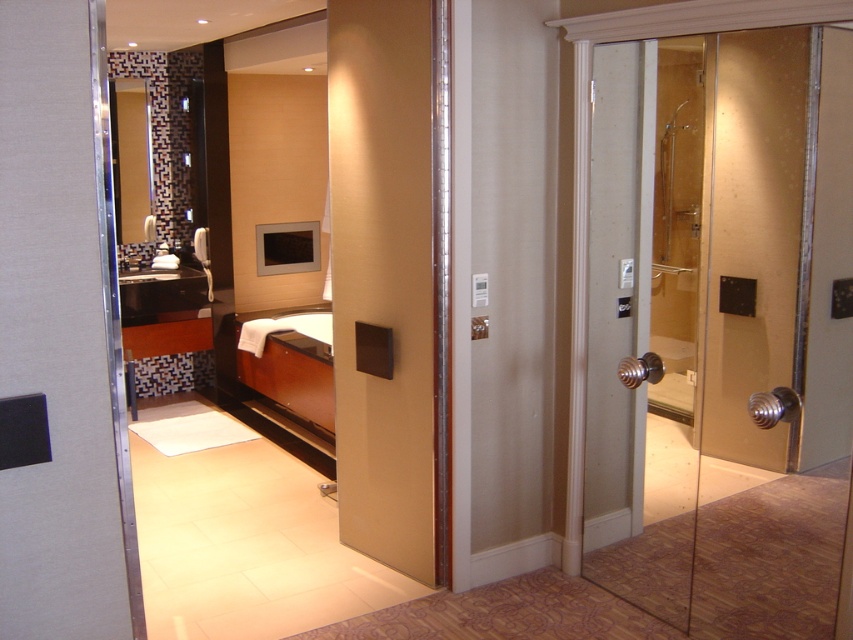
Is transparent glass shower at right smaller than matte black panel at center?

No, transparent glass shower at right is not smaller than matte black panel at center.

Is the position of transparent glass shower at right more distant than that of matte black panel at center?

No.

Does point (756, 173) come closer to viewer compared to point (409, 275)?

Yes, it is in front of point (409, 275).

You are a GUI agent. You are given a task and a screenshot of the screen. Output one action in this format:
    pyautogui.click(x=<x>, y=<y>)
    Task: Click on the transparent glass shower at right
    
    Given the screenshot: What is the action you would take?
    pyautogui.click(x=720, y=326)